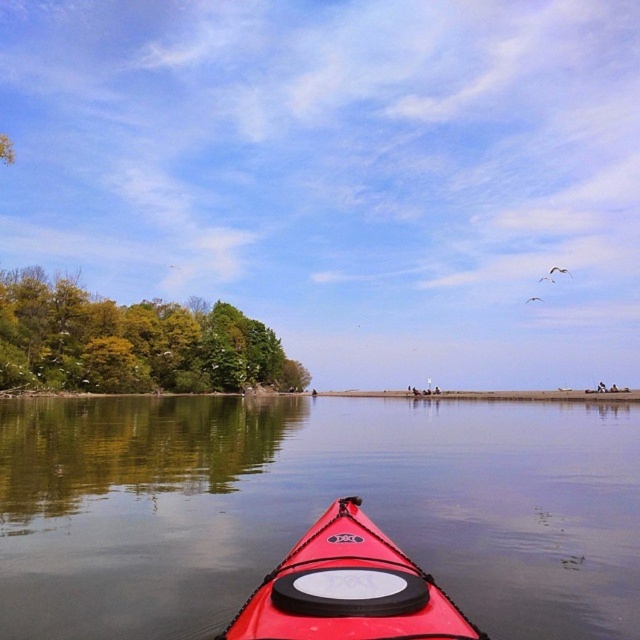
Is point (285, 508) farther from viewer compared to point (202, 332)?

No, it is not.

How far apart are red plastic kayak at center and green leafy trees at left?

red plastic kayak at center is 145.89 feet from green leafy trees at left.

Is point (243, 577) more distant than point (225, 348)?

No, it is in front of (225, 348).

This screenshot has width=640, height=640. In order to click on red plastic kayak at center in this screenshot , I will do `click(312, 508)`.

Is red plastic kayak at center to the right of shiny red canoe at center from the viewer's perspective?

Indeed, red plastic kayak at center is positioned on the right side of shiny red canoe at center.

Measure the distance from red plastic kayak at center to shiny red canoe at center.

151.06 feet

Between point (148, 636) and point (330, 557), which one is positioned behind?

Positioned behind is point (148, 636).

This screenshot has width=640, height=640. I want to click on red plastic kayak at center, so click(312, 508).

Can you confirm if green leafy trees at left is shorter than shiny red canoe at center?

No, green leafy trees at left is not shorter than shiny red canoe at center.

Does green leafy trees at left have a smaller size compared to shiny red canoe at center?

No, green leafy trees at left is not smaller than shiny red canoe at center.

This screenshot has width=640, height=640. Identify the location of green leafy trees at left. (131, 342).

This screenshot has width=640, height=640. What are the coordinates of `green leafy trees at left` in the screenshot? It's located at coord(131,342).